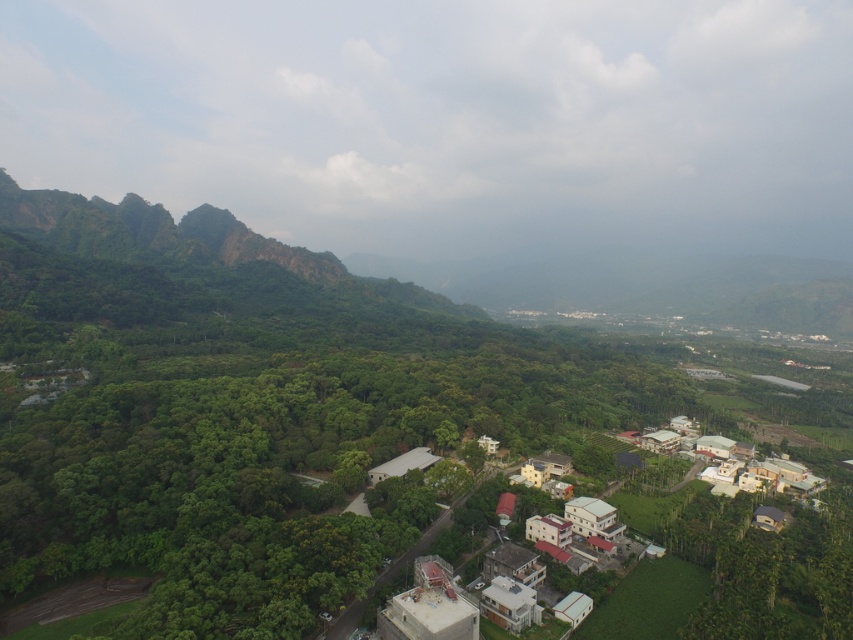
Find the location of a particular element. The width and height of the screenshot is (853, 640). green leafy trees at center is located at coordinates click(280, 472).

Who is positioned more to the right, green leafy trees at center or white matte houses at lower right?

white matte houses at lower right is more to the right.

Find the location of a particular element. The image size is (853, 640). green leafy trees at center is located at coordinates pyautogui.click(x=280, y=472).